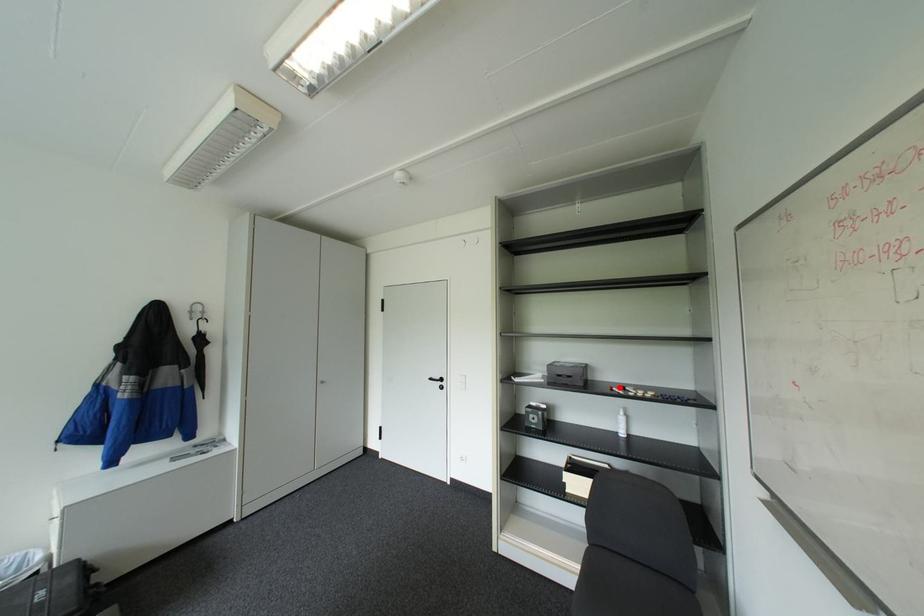
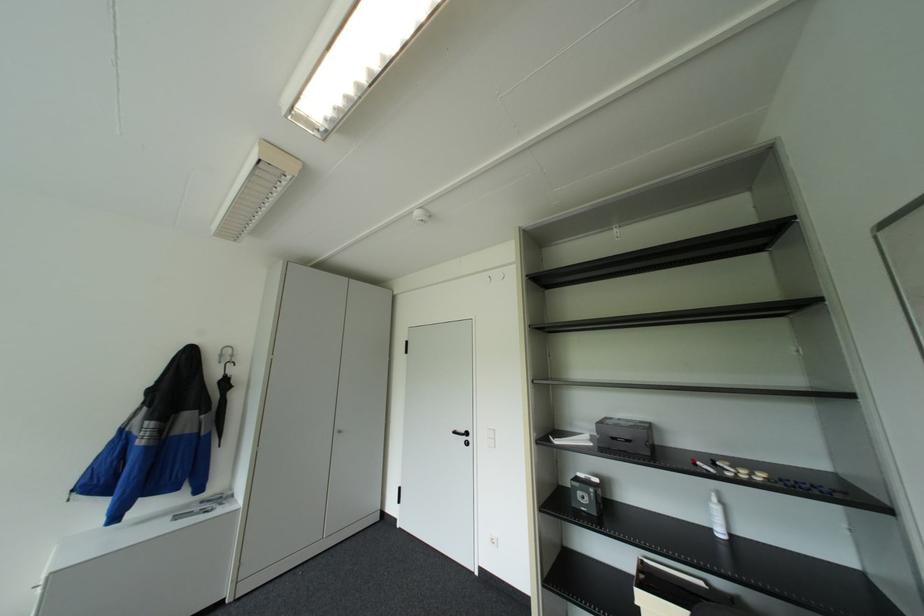
Where in the second image is the point corresponding to the highlighted location from the first image?

(702, 462)